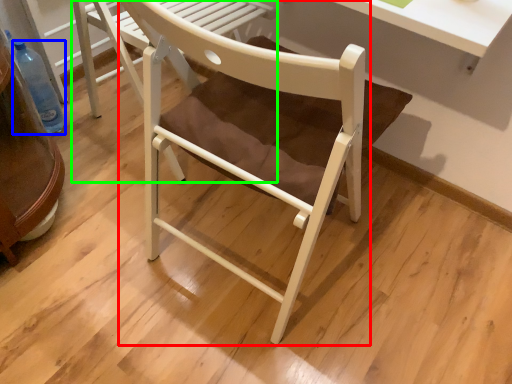
Question: Which is nearer to the chair (highlighted by a red box)? bottle (highlighted by a blue box) or chair (highlighted by a green box).

Choices:
 (A) bottle
 (B) chair

Answer: (B)